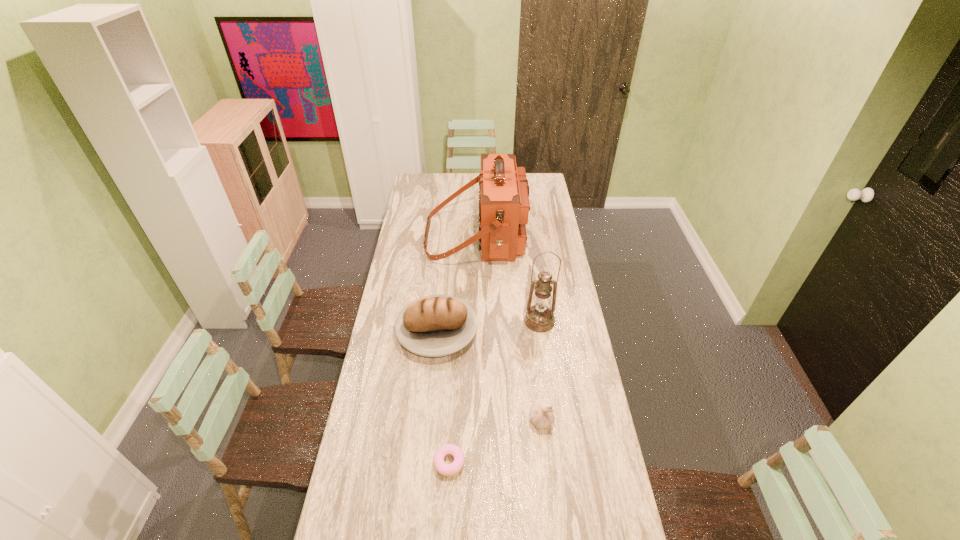
Where is `free point that satisfies the following two spatial constraints: 1. on the face side of the satchel; 2. on the left side of the second nearest object`? This screenshot has width=960, height=540. free point that satisfies the following two spatial constraints: 1. on the face side of the satchel; 2. on the left side of the second nearest object is located at coordinates (475, 421).

Where is `vacant area that satisfies the following two spatial constraints: 1. on the front side of the third shortest object; 2. on the right side of the nearest object`? This screenshot has height=540, width=960. vacant area that satisfies the following two spatial constraints: 1. on the front side of the third shortest object; 2. on the right side of the nearest object is located at coordinates [424, 462].